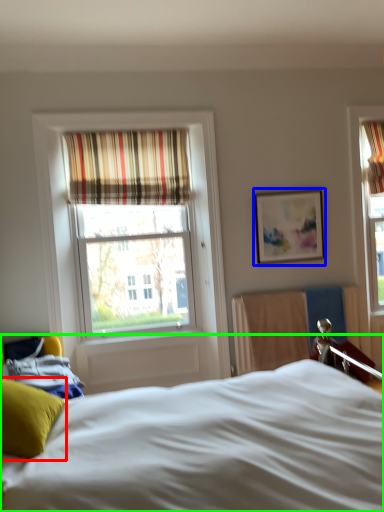
Question: Based on their relative distances, which object is nearer to pillow (highlighted by a red box)? Choose from picture frame (highlighted by a blue box) and bed (highlighted by a green box).

Choices:
 (A) picture frame
 (B) bed

Answer: (B)